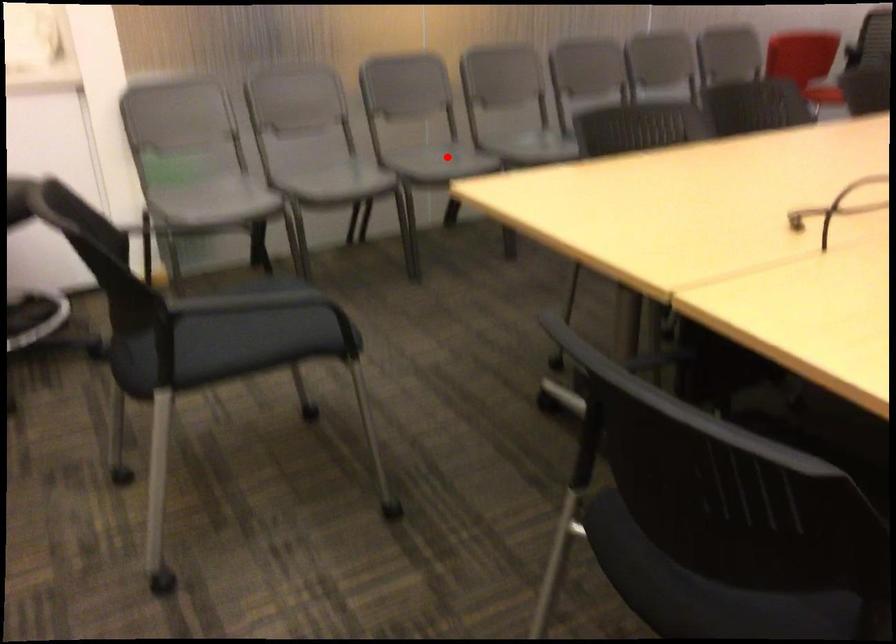
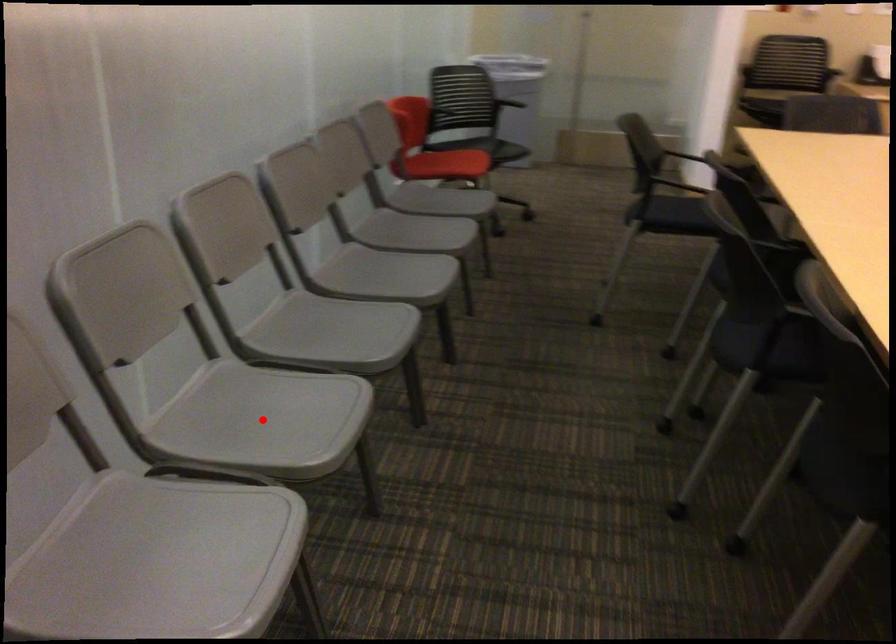
I am providing you with two images of the same scene from different viewpoints. A red point is marked on the first image and another point is marked on the second image. Is the marked point in image1 the same physical position as the marked point in image2?

Yes